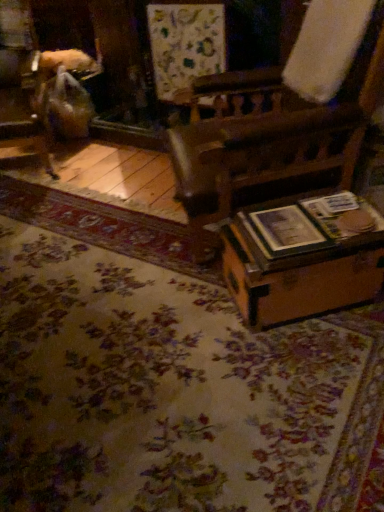
Locate an element on the screen. vacant space underneath wooden chair at left (from a real-world perspective) is located at coordinates (42, 159).